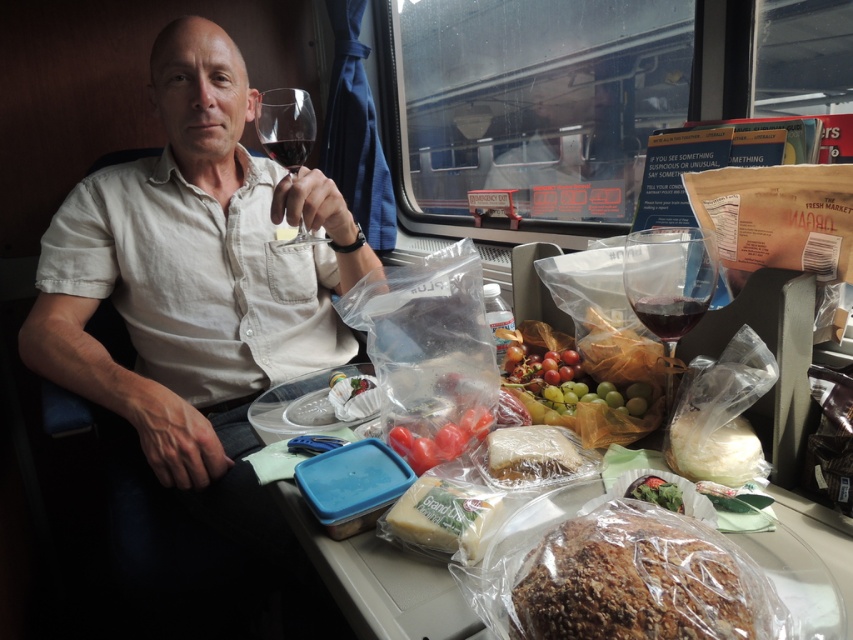
Does matte white shirt at upper left have a lesser width compared to transparent glass at center?

In fact, matte white shirt at upper left might be wider than transparent glass at center.

Does matte white shirt at upper left appear under transparent glass at center?

Yes, matte white shirt at upper left is below transparent glass at center.

Does point (143, 490) come farther from viewer compared to point (685, 276)?

Yes, it is behind point (685, 276).

Locate an element on the screen. The image size is (853, 640). matte white shirt at upper left is located at coordinates (196, 326).

Between glossy plastic grapes at center and green leafy salad at center, which one has less height?

Standing shorter between the two is green leafy salad at center.

Between glossy plastic grapes at center and green leafy salad at center, which one is positioned lower?

green leafy salad at center is below.

Locate an element on the screen. glossy plastic grapes at center is located at coordinates (567, 387).

What do you see at coordinates (669, 278) in the screenshot? I see `transparent glass at center` at bounding box center [669, 278].

What do you see at coordinates (669, 278) in the screenshot? Image resolution: width=853 pixels, height=640 pixels. I see `transparent glass at center` at bounding box center [669, 278].

This screenshot has height=640, width=853. In order to click on transparent glass at center in this screenshot , I will do `click(669, 278)`.